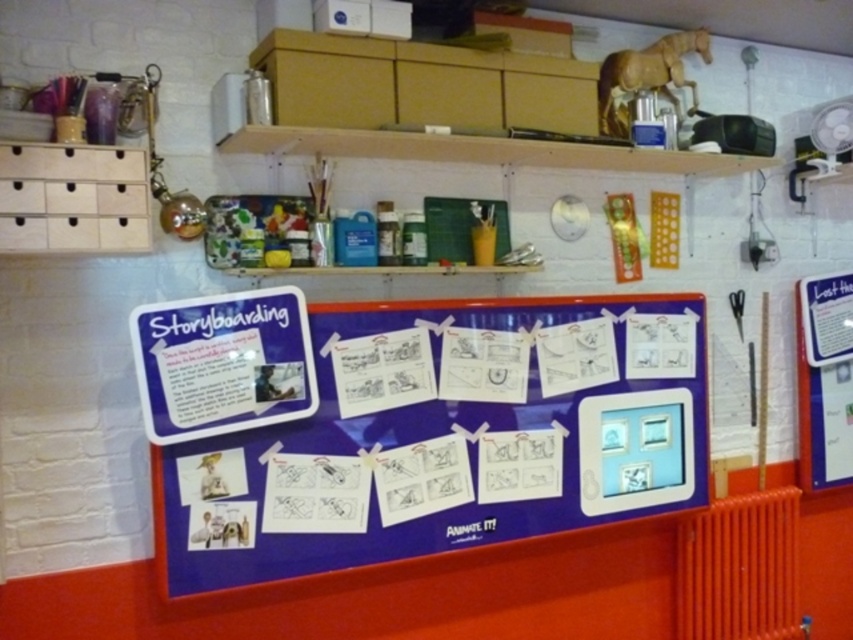
Between blue fabric storyboard at center and orange metallic radiator at lower right, which one has less height?

With less height is orange metallic radiator at lower right.

Identify the location of blue fabric storyboard at center. (450, 436).

Where is `blue fabric storyboard at center`? blue fabric storyboard at center is located at coordinates (450, 436).